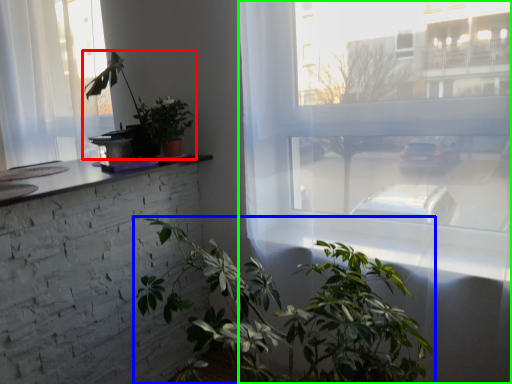
Question: Which is farther away from houseplant (highlighted by a red box)? houseplant (highlighted by a blue box) or window (highlighted by a green box)?

Choices:
 (A) houseplant
 (B) window

Answer: (A)